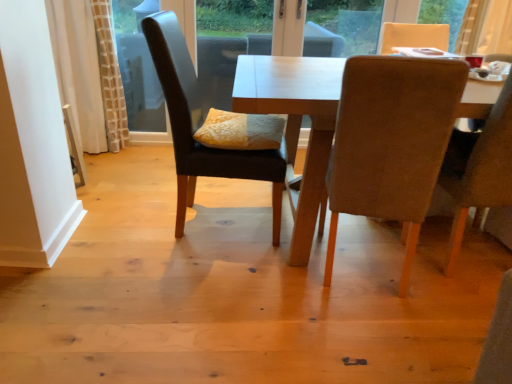
The height and width of the screenshot is (384, 512). I want to click on dark brown leather chair at center, which is counted as the 1th chair, starting from the left, so click(193, 127).

You are a GUI agent. You are given a task and a screenshot of the screen. Output one action in this format:
    pyautogui.click(x=<x>, y=<y>)
    Task: Click on the light brown wooden table at center
    This screenshot has width=512, height=384.
    Given the screenshot: What is the action you would take?
    [x=296, y=122]

Find the location of a particular element. yellow textured pillow at center is located at coordinates (240, 131).

At what (x,y) coordinates should I click in order to perform the action: click on beige fabric chair at right, placed as the 1th chair when sorted from right to left. Please return your answer as a coordinate pair (x, y). The image size is (512, 384). Looking at the image, I should click on (482, 173).

Considering the points (281, 119) and (447, 270), which point is behind, point (281, 119) or point (447, 270)?

The point (281, 119) is farther from the camera.

Measure the distance between dark brown leather chair at center, which is counted as the 1th chair, starting from the left, and beige fabric chair at right, placed as the 1th chair when sorted from right to left.

dark brown leather chair at center, which is counted as the 1th chair, starting from the left, is 38.74 inches away from beige fabric chair at right, placed as the 1th chair when sorted from right to left.

Consider the image. From a real-world perspective, who is located higher, dark brown leather chair at center, which appears as the 3th chair when viewed from the right, or beige fabric chair at right, placed as the 1th chair when sorted from right to left?

beige fabric chair at right, placed as the 1th chair when sorted from right to left.

From the picture: Is dark brown leather chair at center, which appears as the 3th chair when viewed from the right, in front of or behind beige fabric chair at right, positioned as the third chair in left-to-right order, in the image?

In the image, dark brown leather chair at center, which appears as the 3th chair when viewed from the right, appears behind beige fabric chair at right, positioned as the third chair in left-to-right order.

Considering the sizes of beige fabric chair at right, positioned as the third chair in left-to-right order, and dark brown leather chair at center, which appears as the 3th chair when viewed from the right, in the image, is beige fabric chair at right, positioned as the third chair in left-to-right order, taller or shorter than dark brown leather chair at center, which appears as the 3th chair when viewed from the right,?

Considering their sizes, beige fabric chair at right, positioned as the third chair in left-to-right order, has more height than dark brown leather chair at center, which appears as the 3th chair when viewed from the right.

From the image's perspective, between beige fabric chair at right, positioned as the third chair in left-to-right order, and dark brown leather chair at center, which appears as the 3th chair when viewed from the right, who is located below?

beige fabric chair at right, positioned as the third chair in left-to-right order.

Considering the positions of objects beige fabric chair at right, positioned as the third chair in left-to-right order, and dark brown leather chair at center, which is counted as the 1th chair, starting from the left, in the image provided, who is behind, beige fabric chair at right, positioned as the third chair in left-to-right order, or dark brown leather chair at center, which is counted as the 1th chair, starting from the left,?

Positioned behind is dark brown leather chair at center, which is counted as the 1th chair, starting from the left.

In the scene shown: Is beige fabric chair at right, placed as the 1th chair when sorted from right to left, wider than dark brown leather chair at center, which appears as the 3th chair when viewed from the right?

Incorrect, the width of beige fabric chair at right, placed as the 1th chair when sorted from right to left, does not surpass that of dark brown leather chair at center, which appears as the 3th chair when viewed from the right.

Would you say light brown wooden table at center is outside beige fabric chair at right, positioned as the third chair in left-to-right order?

Yes.

Is light brown wooden table at center facing towards beige fabric chair at right, placed as the 1th chair when sorted from right to left?

Yes, light brown wooden table at center is oriented towards beige fabric chair at right, placed as the 1th chair when sorted from right to left.

Considering the sizes of light brown wooden table at center and beige fabric chair at right, positioned as the third chair in left-to-right order, in the image, is light brown wooden table at center taller or shorter than beige fabric chair at right, positioned as the third chair in left-to-right order,?

In the image, light brown wooden table at center appears to be shorter than beige fabric chair at right, positioned as the third chair in left-to-right order.

Is point (338, 82) in front of point (511, 204)?

Yes, it is in front of point (511, 204).

Is beige fabric chair at right, positioned as the third chair in left-to-right order, with transparent glass window screen at upper left?

They are not placed beside each other.

Which is behind, point (490, 188) or point (138, 88)?

The point (138, 88) is farther from the camera.

From the image's perspective, does beige fabric chair at right, placed as the 1th chair when sorted from right to left, appear lower than transparent glass window screen at upper left?

Indeed, from the image's perspective, beige fabric chair at right, placed as the 1th chair when sorted from right to left, is shown beneath transparent glass window screen at upper left.

This screenshot has width=512, height=384. I want to click on window screen above the beige fabric chair at right, placed as the 1th chair when sorted from right to left (from the image's perspective), so click(138, 66).

Which of these two, velvet beige chair at right, which is the 2th chair in right-to-left order, or dark brown leather chair at center, which is counted as the 1th chair, starting from the left, is thinner?

velvet beige chair at right, which is the 2th chair in right-to-left order, is thinner.

Is velvet beige chair at right, which is the 2th chair in right-to-left order, far away from dark brown leather chair at center, which appears as the 3th chair when viewed from the right?

No, there isn't a large distance between velvet beige chair at right, which is the 2th chair in right-to-left order, and dark brown leather chair at center, which appears as the 3th chair when viewed from the right.

Considering the positions of objects velvet beige chair at right, the 2th chair when ordered from left to right, and dark brown leather chair at center, which appears as the 3th chair when viewed from the right, in the image provided, who is behind, velvet beige chair at right, the 2th chair when ordered from left to right, or dark brown leather chair at center, which appears as the 3th chair when viewed from the right,?

Positioned behind is dark brown leather chair at center, which appears as the 3th chair when viewed from the right.

From a real-world perspective, is velvet beige chair at right, which is the 2th chair in right-to-left order, positioned above or below beige fabric chair at right, positioned as the third chair in left-to-right order?

velvet beige chair at right, which is the 2th chair in right-to-left order, is situated lower than beige fabric chair at right, positioned as the third chair in left-to-right order, in the real world.

Which of these two, velvet beige chair at right, the 2th chair when ordered from left to right, or beige fabric chair at right, placed as the 1th chair when sorted from right to left, is wider?

Wider between the two is velvet beige chair at right, the 2th chair when ordered from left to right.

Is velvet beige chair at right, which is the 2th chair in right-to-left order, oriented towards beige fabric chair at right, placed as the 1th chair when sorted from right to left?

No, velvet beige chair at right, which is the 2th chair in right-to-left order, is not oriented towards beige fabric chair at right, placed as the 1th chair when sorted from right to left.

How much distance is there between velvet beige chair at right, which is the 2th chair in right-to-left order, and light brown wooden table at center?

A distance of 11.96 inches exists between velvet beige chair at right, which is the 2th chair in right-to-left order, and light brown wooden table at center.

From the image's perspective, is velvet beige chair at right, the 2th chair when ordered from left to right, on light brown wooden table at center?

Actually, velvet beige chair at right, the 2th chair when ordered from left to right, appears below light brown wooden table at center in the image.

Considering the positions of objects velvet beige chair at right, the 2th chair when ordered from left to right, and light brown wooden table at center in the image provided, who is in front, velvet beige chair at right, the 2th chair when ordered from left to right, or light brown wooden table at center?

Positioned in front is velvet beige chair at right, the 2th chair when ordered from left to right.

What's the angular difference between velvet beige chair at right, the 2th chair when ordered from left to right, and light brown wooden table at center's facing directions?

There is a 172-degree angle between the facing directions of velvet beige chair at right, the 2th chair when ordered from left to right, and light brown wooden table at center.

Locate an element on the screen. The height and width of the screenshot is (384, 512). chair above the beige fabric chair at right, placed as the 1th chair when sorted from right to left (from the image's perspective) is located at coordinates (193, 127).

Where is `the 2nd chair counting from the right of the dark brown leather chair at center, which appears as the 3th chair when viewed from the right`? the 2nd chair counting from the right of the dark brown leather chair at center, which appears as the 3th chair when viewed from the right is located at coordinates (482, 173).

Looking at the image, which one is located closer to transparent glass window screen at upper left, yellow textured pillow at center or dark brown leather chair at center, which appears as the 3th chair when viewed from the right?

The object closer to transparent glass window screen at upper left is dark brown leather chair at center, which appears as the 3th chair when viewed from the right.

Estimate the real-world distances between objects in this image. Which object is further from light brown wooden table at center, beige fabric chair at right, positioned as the third chair in left-to-right order, or dark brown leather chair at center, which appears as the 3th chair when viewed from the right?

beige fabric chair at right, positioned as the third chair in left-to-right order.

Looking at the image, which one is located closer to dark brown leather chair at center, which is counted as the 1th chair, starting from the left, velvet beige chair at right, the 2th chair when ordered from left to right, or transparent glass window screen at upper left?

velvet beige chair at right, the 2th chair when ordered from left to right, is positioned closer to the anchor dark brown leather chair at center, which is counted as the 1th chair, starting from the left.

Looking at this image, when comparing their distances from velvet beige chair at right, the 2th chair when ordered from left to right, does light brown wooden table at center or yellow textured pillow at center seem closer?

light brown wooden table at center is positioned closer to the anchor velvet beige chair at right, the 2th chair when ordered from left to right.

Based on their spatial positions, is beige fabric chair at right, placed as the 1th chair when sorted from right to left, or transparent glass window screen at upper left further from dark brown leather chair at center, which is counted as the 1th chair, starting from the left?

transparent glass window screen at upper left lies further to dark brown leather chair at center, which is counted as the 1th chair, starting from the left, than the other object.

Based on their spatial positions, is light brown wooden table at center or yellow textured pillow at center closer to dark brown leather chair at center, which appears as the 3th chair when viewed from the right?

yellow textured pillow at center lies closer to dark brown leather chair at center, which appears as the 3th chair when viewed from the right, than the other object.

Based on their spatial positions, is light brown wooden table at center or velvet beige chair at right, which is the 2th chair in right-to-left order, closer to beige fabric chair at right, positioned as the third chair in left-to-right order?

Based on the image, velvet beige chair at right, which is the 2th chair in right-to-left order, appears to be nearer to beige fabric chair at right, positioned as the third chair in left-to-right order.

From the image, which object appears to be farther from dark brown leather chair at center, which is counted as the 1th chair, starting from the left, beige fabric chair at right, positioned as the third chair in left-to-right order, or velvet beige chair at right, which is the 2th chair in right-to-left order?

The object further to dark brown leather chair at center, which is counted as the 1th chair, starting from the left, is beige fabric chair at right, positioned as the third chair in left-to-right order.

I want to click on pillow between dark brown leather chair at center, which is counted as the 1th chair, starting from the left, and transparent glass window screen at upper left, along the z-axis, so click(x=240, y=131).

Image resolution: width=512 pixels, height=384 pixels. I want to click on kitchen & dining room table situated between transparent glass window screen at upper left and beige fabric chair at right, positioned as the third chair in left-to-right order, from left to right, so click(x=296, y=122).

Where is `pillow between transparent glass window screen at upper left and beige fabric chair at right, placed as the 1th chair when sorted from right to left, from left to right`? pillow between transparent glass window screen at upper left and beige fabric chair at right, placed as the 1th chair when sorted from right to left, from left to right is located at coordinates (240, 131).

Locate an element on the screen. kitchen & dining room table between yellow textured pillow at center and beige fabric chair at right, placed as the 1th chair when sorted from right to left, from left to right is located at coordinates (296, 122).